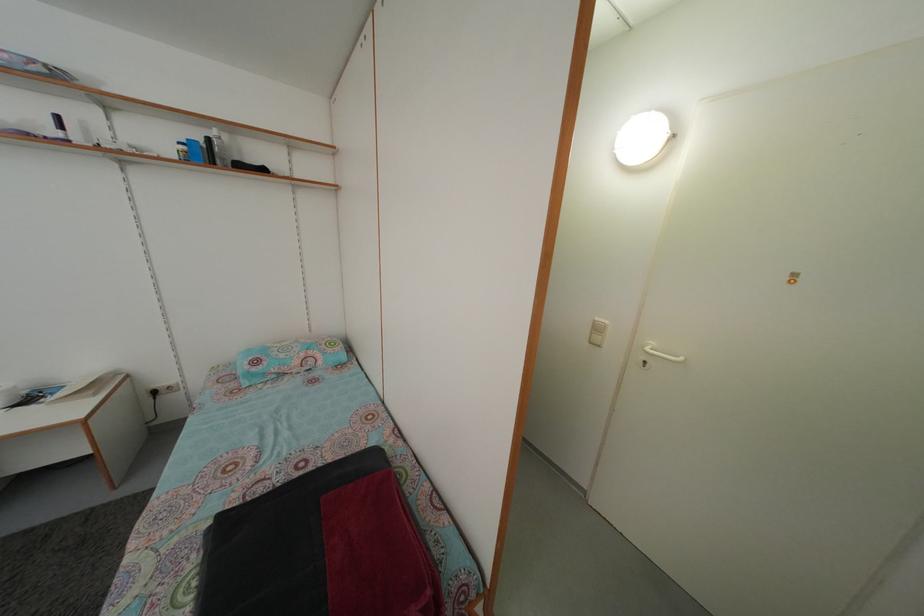
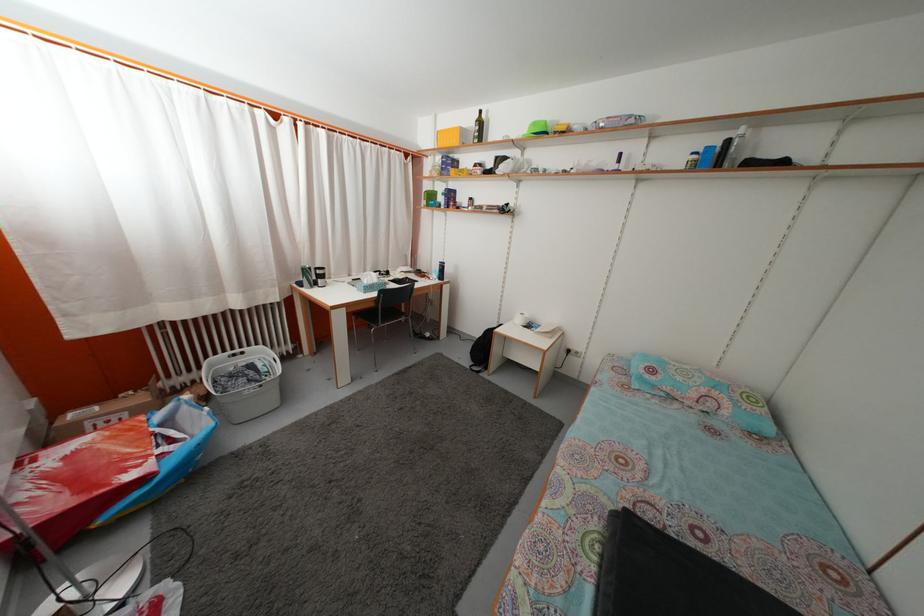
The point at (189, 155) is marked in the first image. Where is the corresponding point in the second image?

(699, 164)